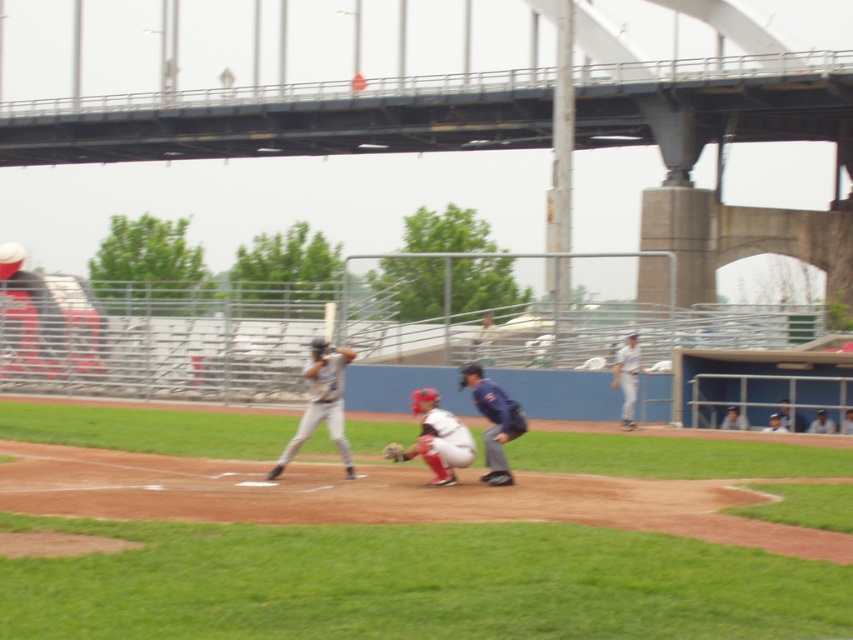
Question: Which of the following is the closest to the observer?

Choices:
 (A) white baseball cap at upper center
 (B) wooden baseball bat at center
 (C) matte blue uniform at center
 (D) gray matte uniform at center

Answer: (C)

Question: Can you confirm if gray matte uniform at center is positioned above brown leather glove at center?

Choices:
 (A) yes
 (B) no

Answer: (A)

Question: Which object is positioned farthest from the matte blue uniform at center?

Choices:
 (A) white matte uniform at center
 (B) gray matte uniform at center
 (C) white baseball cap at upper center

Answer: (C)

Question: Observing the image, what is the correct spatial positioning of gray matte uniform at center in reference to white baseball cap at upper center?

Choices:
 (A) right
 (B) left

Answer: (B)

Question: Based on their relative distances, which object is nearer to the brown leather glove at center?

Choices:
 (A) white uniform at right
 (B) white uniform at center

Answer: (A)

Question: Is gray matte uniform at center further to camera compared to white baseball cap at upper center?

Choices:
 (A) yes
 (B) no

Answer: (B)